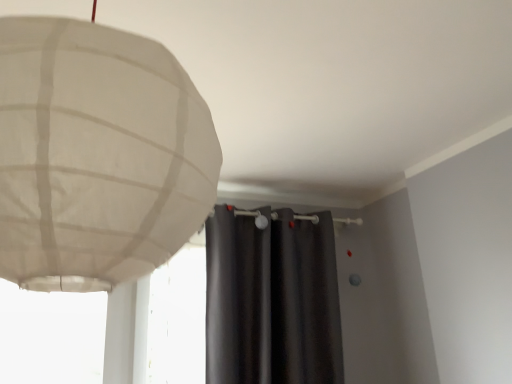
Question: From a real-world perspective, is white paper lampshade at upper left over dark gray matte curtain at center?

Choices:
 (A) yes
 (B) no

Answer: (A)

Question: Is white paper lampshade at upper left wider than dark gray matte curtain at center?

Choices:
 (A) yes
 (B) no

Answer: (A)

Question: From a real-world perspective, does white paper lampshade at upper left sit lower than dark gray matte curtain at center?

Choices:
 (A) yes
 (B) no

Answer: (B)

Question: Is dark gray matte curtain at center a part of white paper lampshade at upper left?

Choices:
 (A) yes
 (B) no

Answer: (B)

Question: Is white paper lampshade at upper left next to dark gray matte curtain at center?

Choices:
 (A) yes
 (B) no

Answer: (B)

Question: Considering the relative sizes of white paper lampshade at upper left and dark gray matte curtain at center in the image provided, is white paper lampshade at upper left smaller than dark gray matte curtain at center?

Choices:
 (A) no
 (B) yes

Answer: (B)

Question: From a real-world perspective, does dark gray matte curtain at center stand above white paper lampshade at upper left?

Choices:
 (A) yes
 (B) no

Answer: (B)

Question: Considering the relative positions of dark gray matte curtain at center and white paper lampshade at upper left in the image provided, is dark gray matte curtain at center to the right of white paper lampshade at upper left from the viewer's perspective?

Choices:
 (A) yes
 (B) no

Answer: (A)

Question: Can you confirm if dark gray matte curtain at center is bigger than white paper lampshade at upper left?

Choices:
 (A) no
 (B) yes

Answer: (B)

Question: Can you confirm if dark gray matte curtain at center is smaller than white paper lampshade at upper left?

Choices:
 (A) no
 (B) yes

Answer: (A)

Question: Can white paper lampshade at upper left be found inside dark gray matte curtain at center?

Choices:
 (A) no
 (B) yes

Answer: (A)

Question: Is dark gray matte curtain at center at the left side of white paper lampshade at upper left?

Choices:
 (A) yes
 (B) no

Answer: (B)

Question: Is white paper lampshade at upper left taller or shorter than dark gray matte curtain at center?

Choices:
 (A) tall
 (B) short

Answer: (B)